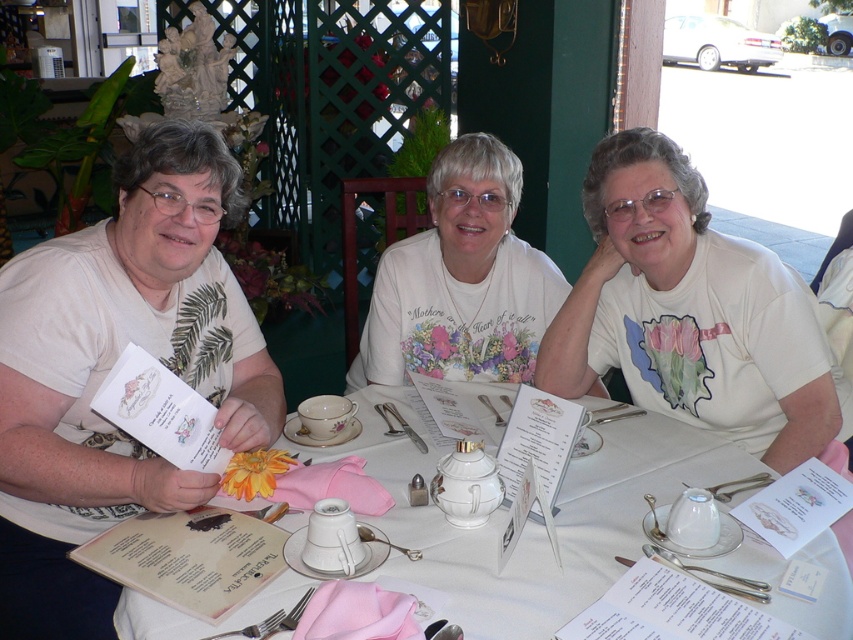
Which is more to the right, white printed menu at left or white matte shirt at center?

From the viewer's perspective, white matte shirt at center appears more on the right side.

Is point (102, 284) in front of point (792, 432)?

That is True.

Find the location of a particular element. Image resolution: width=853 pixels, height=640 pixels. white printed menu at left is located at coordinates (109, 365).

Is white floral shirt at center above white glossy teapot at center?

Yes, white floral shirt at center is above white glossy teapot at center.

Is white floral shirt at center to the left of white glossy teapot at center from the viewer's perspective?

Incorrect, white floral shirt at center is not on the left side of white glossy teapot at center.

What do you see at coordinates (461, 280) in the screenshot? The image size is (853, 640). I see `white floral shirt at center` at bounding box center [461, 280].

This screenshot has width=853, height=640. Find the location of `white floral shirt at center`. white floral shirt at center is located at coordinates (461, 280).

Does white printed menu at left come in front of white porcelain teapot at center?

No, it is not.

Is point (33, 545) positioned before point (375, 396)?

That is True.

Identify the location of white printed menu at left. (109, 365).